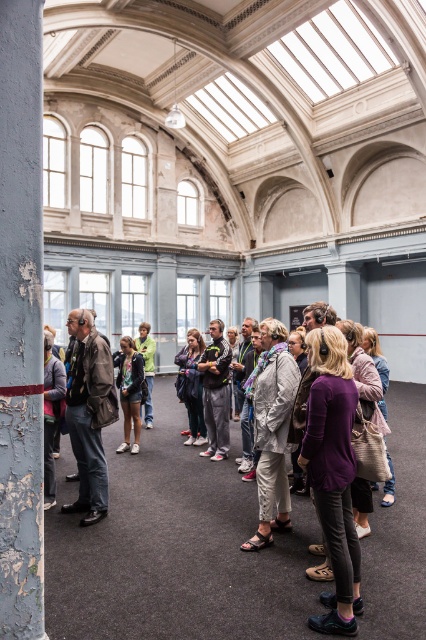
Does leather jacket at center appear on the left side of green denim jacket at center?

In fact, leather jacket at center is to the right of green denim jacket at center.

Is leather jacket at center taller than green denim jacket at center?

Correct, leather jacket at center is much taller as green denim jacket at center.

Which is behind, point (186, 444) or point (146, 412)?

Positioned behind is point (146, 412).

You are a GUI agent. You are given a task and a screenshot of the screen. Output one action in this format:
    pyautogui.click(x=<x>, y=<y>)
    Task: Click on the leather jacket at center
    Image resolution: width=426 pixels, height=640 pixels.
    Given the screenshot: What is the action you would take?
    pyautogui.click(x=192, y=385)

Which is more to the right, purple matte shirt at center or matte brown leather jacket at left?

From the viewer's perspective, purple matte shirt at center appears more on the right side.

Is purple matte shirt at center wider than matte brown leather jacket at left?

No, purple matte shirt at center is not wider than matte brown leather jacket at left.

What are the coordinates of `purple matte shirt at center` in the screenshot? It's located at (333, 474).

Measure the distance between multicolored casual clothing at center and peeling paint column at left.

They are 6.68 feet apart.

Does point (155, 428) come behind point (40, 355)?

Yes, it is behind point (40, 355).

Between point (299, 576) and point (22, 154), which one is positioned in front?

Point (22, 154)

You are a GUI agent. You are given a task and a screenshot of the screen. Output one action in this format:
    pyautogui.click(x=<x>, y=<y>)
    Task: Click on the multicolored casual clothing at center
    This screenshot has height=640, width=426.
    Given the screenshot: What is the action you would take?
    pyautogui.click(x=176, y=548)